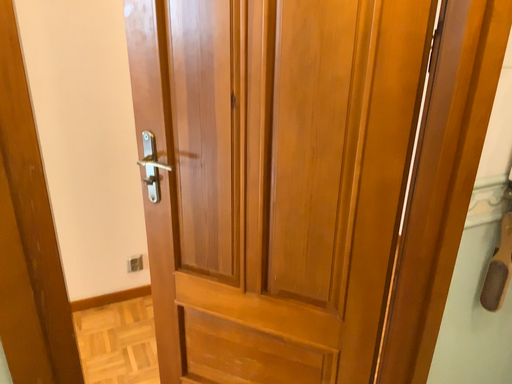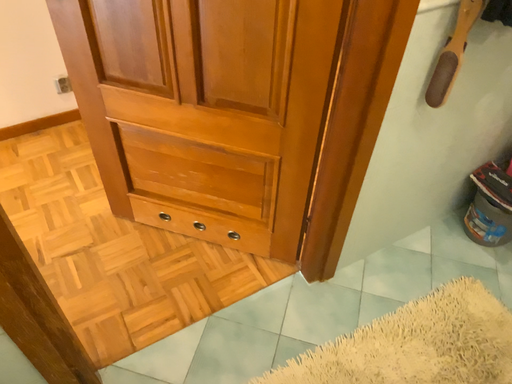
Question: Which way did the camera rotate in the video?

Choices:
 (A) rotated downward
 (B) rotated upward

Answer: (A)